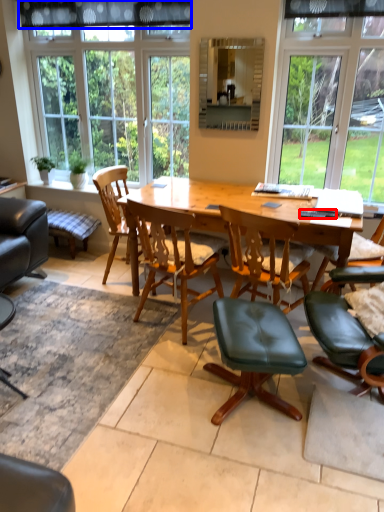
Question: Which point is closer to the camera, remote control (highlighted by a red box) or curtain (highlighted by a blue box)?

Choices:
 (A) remote control
 (B) curtain

Answer: (A)